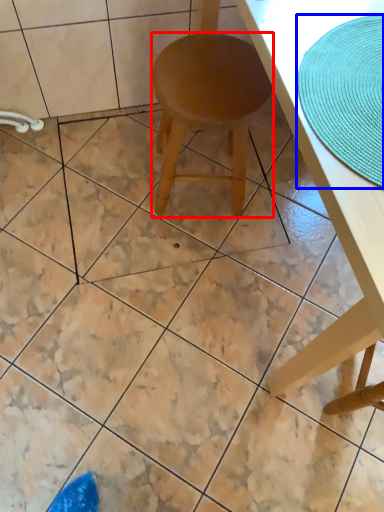
Question: Which point is closer to the camera, stool (highlighted by a red box) or mat (highlighted by a blue box)?

Choices:
 (A) stool
 (B) mat

Answer: (B)